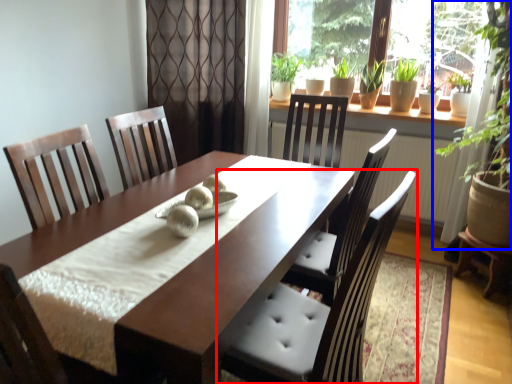
Question: Which object appears farthest to the camera in this image, chair (highlighted by a red box) or houseplant (highlighted by a blue box)?

Choices:
 (A) chair
 (B) houseplant

Answer: (B)